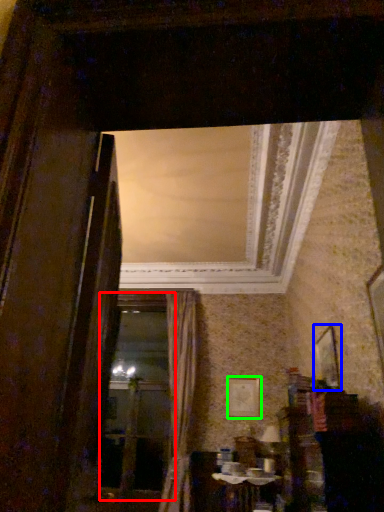
Question: Estimate the real-world distances between objects in this image. Which object is closer to window frame (highlighted by a red box), picture frame (highlighted by a blue box) or picture frame (highlighted by a green box)?

Choices:
 (A) picture frame
 (B) picture frame

Answer: (B)